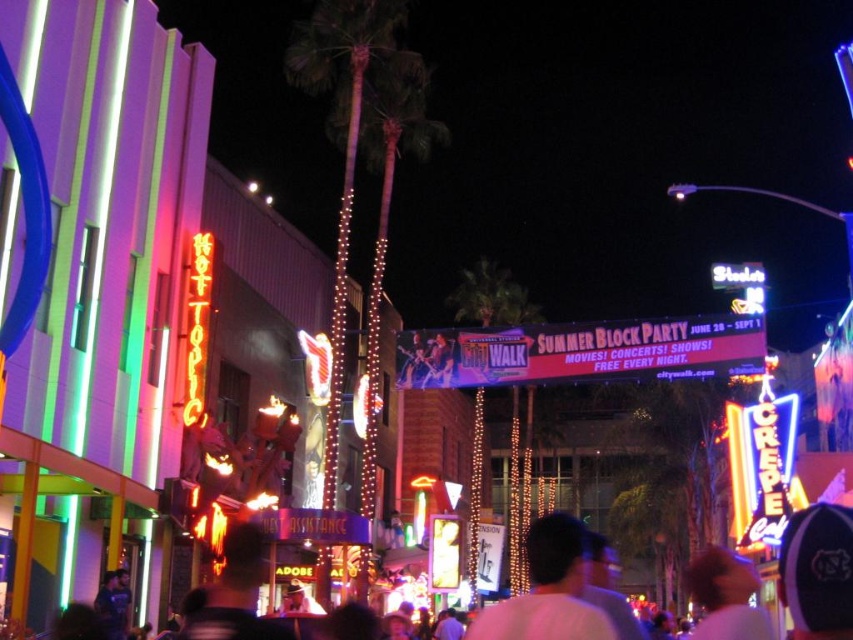
Is white cotton crowd at center taller than blurred hair at center?

In fact, white cotton crowd at center may be shorter than blurred hair at center.

Does white cotton crowd at center appear under blurred hair at center?

No.

Find the location of a particular element. This screenshot has width=853, height=640. white cotton crowd at center is located at coordinates (817, 572).

Who is lower down, white matte shirt at center or blurred hair at center?

blurred hair at center

Can you confirm if white matte shirt at center is smaller than blurred hair at center?

Yes.

Which is behind, point (556, 547) or point (759, 630)?

The point (556, 547) is more distant.

You are a GUI agent. You are given a task and a screenshot of the screen. Output one action in this format:
    pyautogui.click(x=<x>, y=<y>)
    Task: Click on the white matte shirt at center
    The image size is (853, 640).
    Given the screenshot: What is the action you would take?
    pyautogui.click(x=548, y=589)

Who is lower down, white cotton crowd at center or white matte shirt at center?

white matte shirt at center is lower down.

Looking at this image, between white cotton crowd at center and white matte shirt at center, which one has more height?

white matte shirt at center is taller.

Between point (816, 634) and point (480, 616), which one is positioned in front?

Point (480, 616) is more forward.

This screenshot has width=853, height=640. In order to click on white cotton crowd at center in this screenshot , I will do `click(817, 572)`.